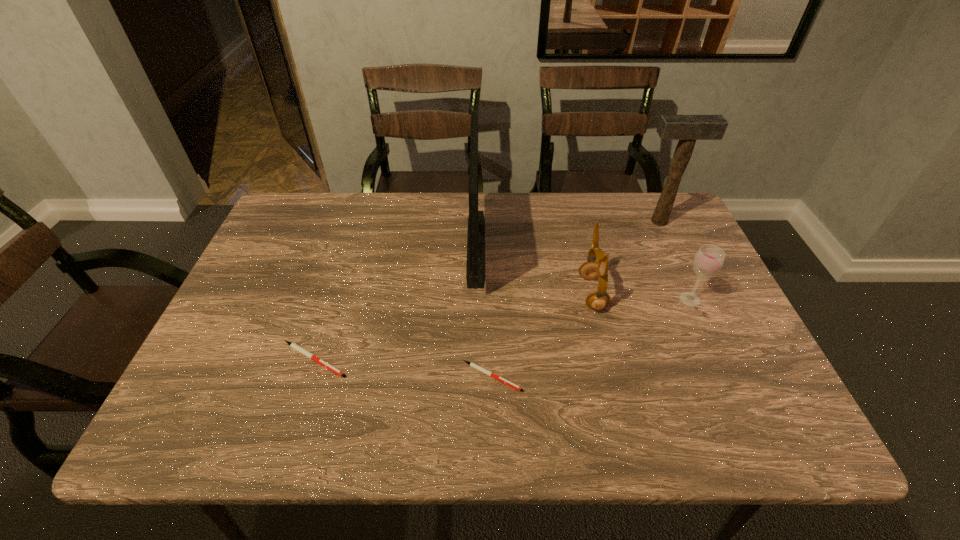
The height and width of the screenshot is (540, 960). Find the location of `vacant space in between the taller pen and the shortest object`. vacant space in between the taller pen and the shortest object is located at coordinates (403, 368).

At what (x,y) coordinates should I click in order to perform the action: click on blank region between the mallet and the monitor. Please return your answer as a coordinate pair (x, y). Image resolution: width=960 pixels, height=540 pixels. Looking at the image, I should click on (567, 234).

You are a GUI agent. You are given a task and a screenshot of the screen. Output one action in this format:
    pyautogui.click(x=<x>, y=<y>)
    Task: Click on the vacant point located between the mallet and the taller pen
    This screenshot has width=960, height=540.
    Given the screenshot: What is the action you would take?
    pyautogui.click(x=487, y=291)

Where is `free space between the shortest object and the earphone`? free space between the shortest object and the earphone is located at coordinates (541, 335).

Locate an element on the screen. This screenshot has height=540, width=960. free spot between the leftmost object and the right pen is located at coordinates (403, 368).

You are a GUI agent. You are given a task and a screenshot of the screen. Output one action in this format:
    pyautogui.click(x=<x>, y=<y>)
    Task: Click on the free space between the fourth tallest object and the mallet
    
    Given the screenshot: What is the action you would take?
    pyautogui.click(x=675, y=260)

At what (x,y) coordinates should I click in order to perform the action: click on free spot between the mallet and the monitor. Please return your answer as a coordinate pair (x, y). Looking at the image, I should click on (567, 234).

What are the coordinates of `object that can be found as the closest to the third tallest object` in the screenshot? It's located at (709, 259).

The height and width of the screenshot is (540, 960). What are the coordinates of `the third closest object relative to the third shortest object` in the screenshot? It's located at [x=471, y=364].

The image size is (960, 540). I want to click on vacant area in the image that satisfies the following two spatial constraints: 1. on the front side of the mallet; 2. on the front-facing side of the monitor, so click(670, 246).